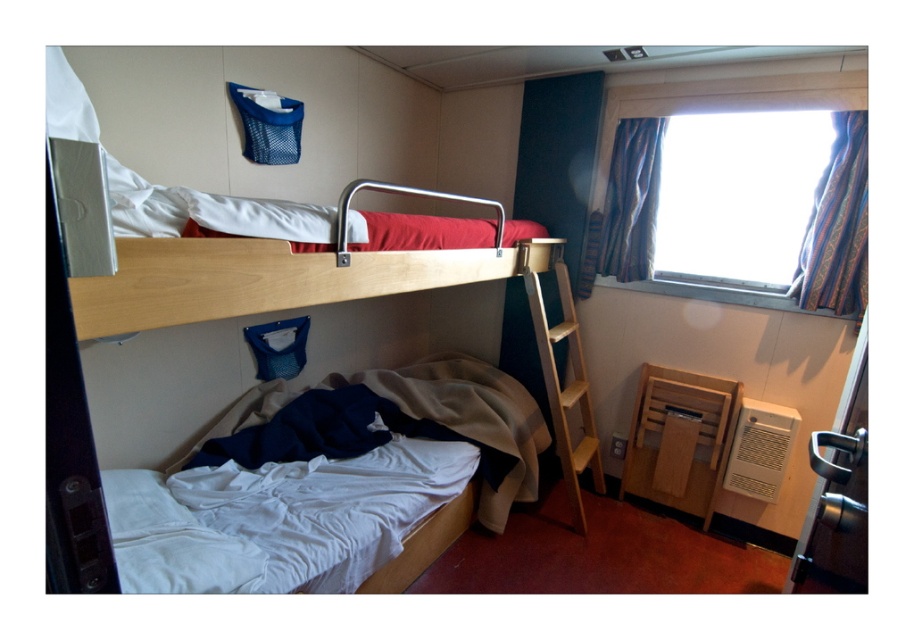
Describe the element at coordinates (326, 480) in the screenshot. I see `white cotton bed at lower left` at that location.

Which is in front, point (291, 499) or point (697, 259)?

Point (291, 499) is in front.

Identify the location of white cotton bed at lower left. This screenshot has width=914, height=640. (326, 480).

Which is above, multicolored woven curtain at window or wooden at right?

multicolored woven curtain at window is above.

Measure the distance between multicolored woven curtain at window and camera.

They are 7.60 feet apart.

Measure the distance between multicolored woven curtain at window and camera.

multicolored woven curtain at window is 7.60 feet from camera.

Find the location of a particular element. This screenshot has height=640, width=914. multicolored woven curtain at window is located at coordinates (837, 225).

Between wooden bunk bed at center and striped fabric curtain at window, which one has less height?

striped fabric curtain at window

How distant is wooden bunk bed at center from striped fabric curtain at window?

wooden bunk bed at center is 34.26 inches from striped fabric curtain at window.

Is point (477, 419) in front of point (630, 148)?

Yes, it is in front of point (630, 148).

At what (x,y) coordinates should I click in order to perform the action: click on wooden bunk bed at center. Please return your answer as a coordinate pair (x, y). Image resolution: width=914 pixels, height=640 pixels. Looking at the image, I should click on (330, 483).